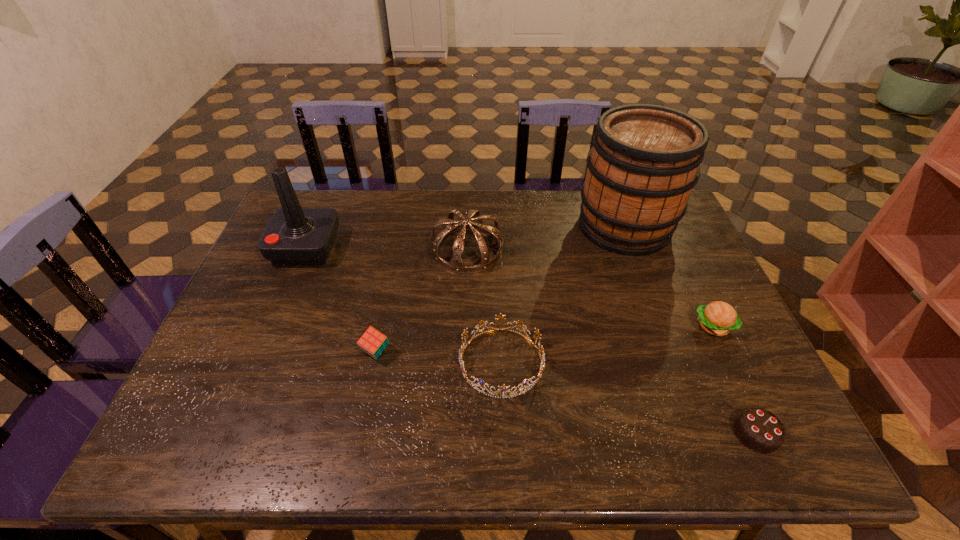
You are a GUI agent. You are given a task and a screenshot of the screen. Output one action in this format:
    pyautogui.click(x=<x>, y=<y>)
    Task: Click on the cider
    The width and height of the screenshot is (960, 540).
    Given the screenshot: What is the action you would take?
    pyautogui.click(x=644, y=162)

Where is `joystick`? joystick is located at coordinates (294, 236).

Image resolution: width=960 pixels, height=540 pixels. Find the location of `the leftmost object`. the leftmost object is located at coordinates (294, 236).

What are the coordinates of `the taller tiara` in the screenshot? It's located at (456, 264).

At what (x,y) coordinates should I click in order to perform the action: click on the third tallest object. Please return your answer as a coordinate pair (x, y). Looking at the image, I should click on (456, 264).

The width and height of the screenshot is (960, 540). I want to click on hamburger, so click(x=718, y=318).

The image size is (960, 540). Find the location of `the second object from left to right`. the second object from left to right is located at coordinates (372, 342).

Find the location of a particular element. the nearer tiara is located at coordinates (461, 351).

I want to click on chocolate cake, so click(x=759, y=430).

The width and height of the screenshot is (960, 540). Find the location of `vacant area situated on the front of the cider`. vacant area situated on the front of the cider is located at coordinates (660, 325).